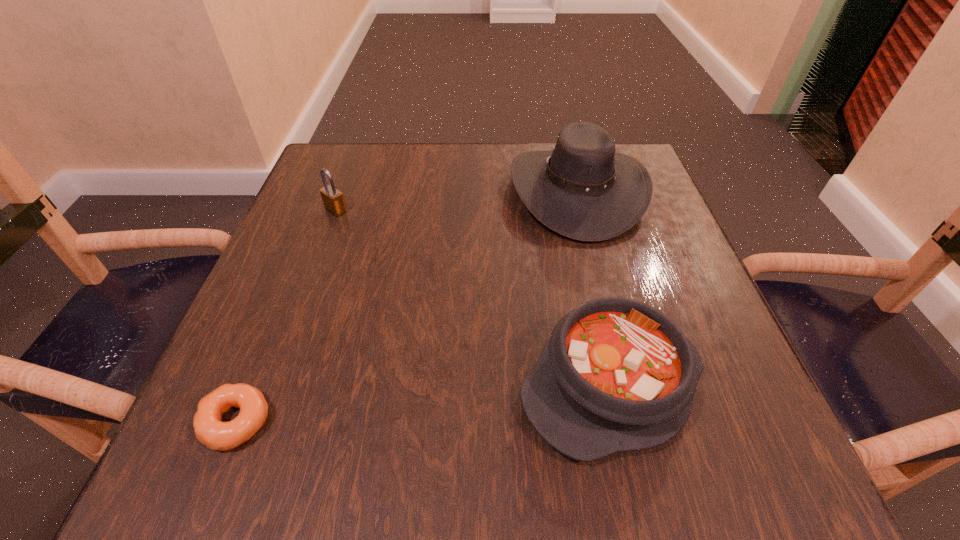
Where is `vacant point that satisfies the following two spatial constraints: 1. on the back side of the padlock; 2. on the left side of the shortest object`? The image size is (960, 540). vacant point that satisfies the following two spatial constraints: 1. on the back side of the padlock; 2. on the left side of the shortest object is located at coordinates (x=323, y=210).